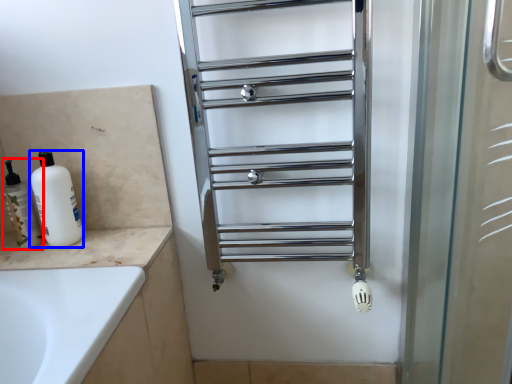
Question: Which object is closer to the camera taking this photo, toiletry (highlighted by a red box) or cleaning product (highlighted by a blue box)?

Choices:
 (A) toiletry
 (B) cleaning product

Answer: (B)